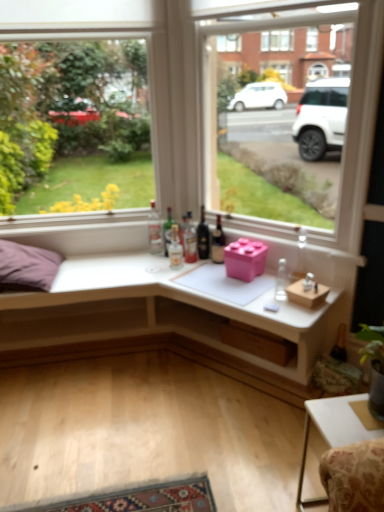
You are a GUI agent. You are given a task and a screenshot of the screen. Output one action in this format:
    pyautogui.click(x=<x>, y=<y>)
    Task: Click on the vacant area that is in front of pink matte plastic cube at center, which appears as the 1th window box when viewed from the top
    This screenshot has width=384, height=512.
    Given the screenshot: What is the action you would take?
    pyautogui.click(x=245, y=289)